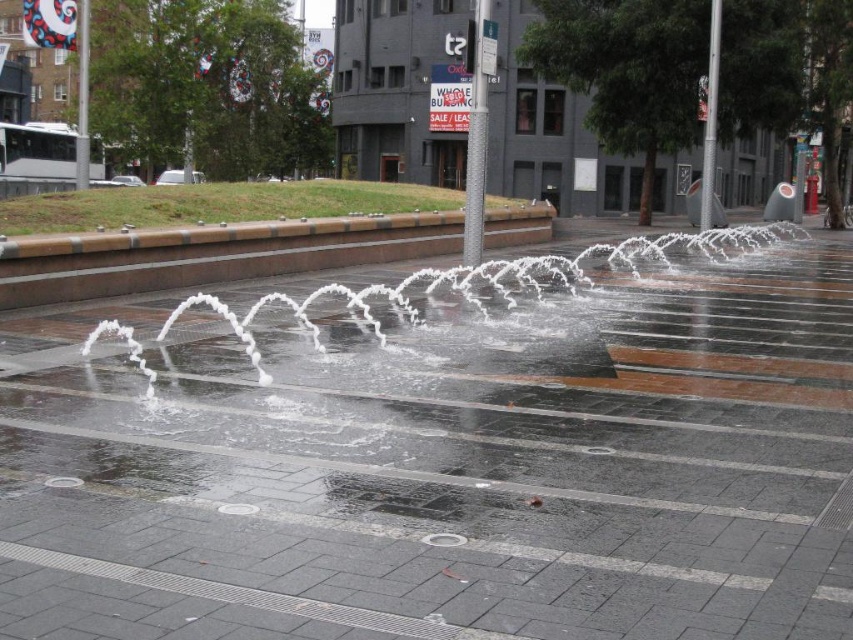
Does wet concrete pavement at center have a larger size compared to brown concrete curb at center?

Yes, wet concrete pavement at center is bigger than brown concrete curb at center.

Which is below, wet concrete pavement at center or brown concrete curb at center?

wet concrete pavement at center

Is point (260, 611) closer to camera compared to point (178, 266)?

Yes, it is in front of point (178, 266).

In order to click on wet concrete pavement at center in this screenshot , I will do `click(445, 454)`.